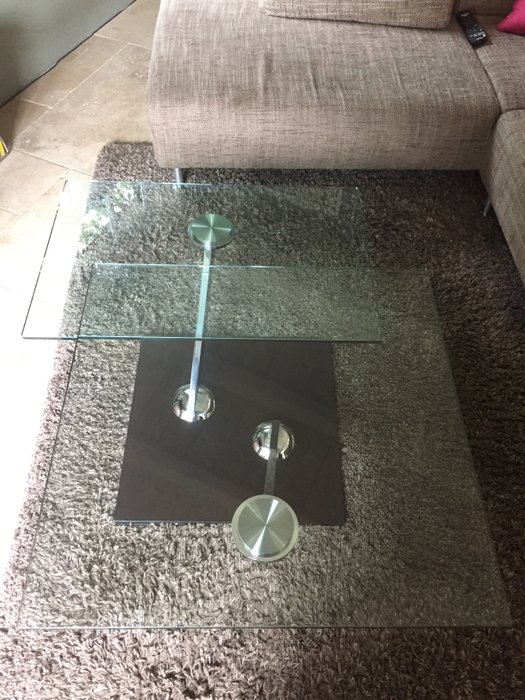
Where is `couch cushions`? The height and width of the screenshot is (700, 525). couch cushions is located at coordinates (336, 57), (511, 59).